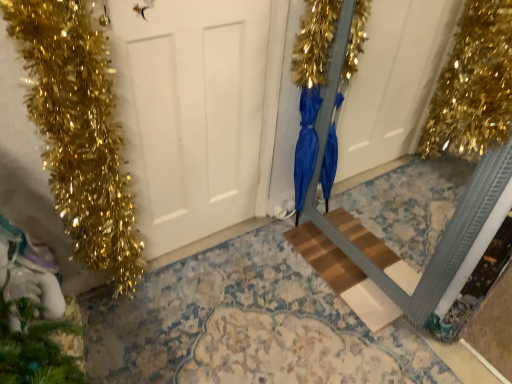
Question: Can you confirm if white matte door at center is positioned to the left of blue satin dress at center?

Choices:
 (A) yes
 (B) no

Answer: (A)

Question: Can you confirm if white matte door at center is thinner than blue satin dress at center?

Choices:
 (A) yes
 (B) no

Answer: (A)

Question: Would you consider white matte door at center to be distant from blue satin dress at center?

Choices:
 (A) yes
 (B) no

Answer: (B)

Question: From a real-world perspective, is white matte door at center beneath blue satin dress at center?

Choices:
 (A) no
 (B) yes

Answer: (A)

Question: Is blue satin dress at center inside white matte door at center?

Choices:
 (A) yes
 (B) no

Answer: (B)

Question: Is wooden step at center spatially inside blue satin dress at center, or outside of it?

Choices:
 (A) inside
 (B) outside

Answer: (B)

Question: From a real-world perspective, is wooden step at center above or below blue satin dress at center?

Choices:
 (A) below
 (B) above

Answer: (A)

Question: Relative to blue satin dress at center, is wooden step at center in front or behind?

Choices:
 (A) front
 (B) behind

Answer: (B)

Question: Is wooden step at center taller or shorter than blue satin dress at center?

Choices:
 (A) tall
 (B) short

Answer: (B)

Question: From the image's perspective, is blue satin dress at center located above or below wooden step at center?

Choices:
 (A) below
 (B) above

Answer: (B)

Question: Do you think blue satin dress at center is within wooden step at center, or outside of it?

Choices:
 (A) inside
 (B) outside

Answer: (B)

Question: From a real-world perspective, is blue satin dress at center physically located above or below wooden step at center?

Choices:
 (A) below
 (B) above

Answer: (B)

Question: Relative to wooden step at center, is blue satin dress at center in front or behind?

Choices:
 (A) front
 (B) behind

Answer: (A)

Question: Is green matte pine cone at lower left to the left or to the right of wooden step at center in the image?

Choices:
 (A) left
 (B) right

Answer: (A)

Question: From a real-world perspective, is green matte pine cone at lower left positioned above or below wooden step at center?

Choices:
 (A) below
 (B) above

Answer: (B)